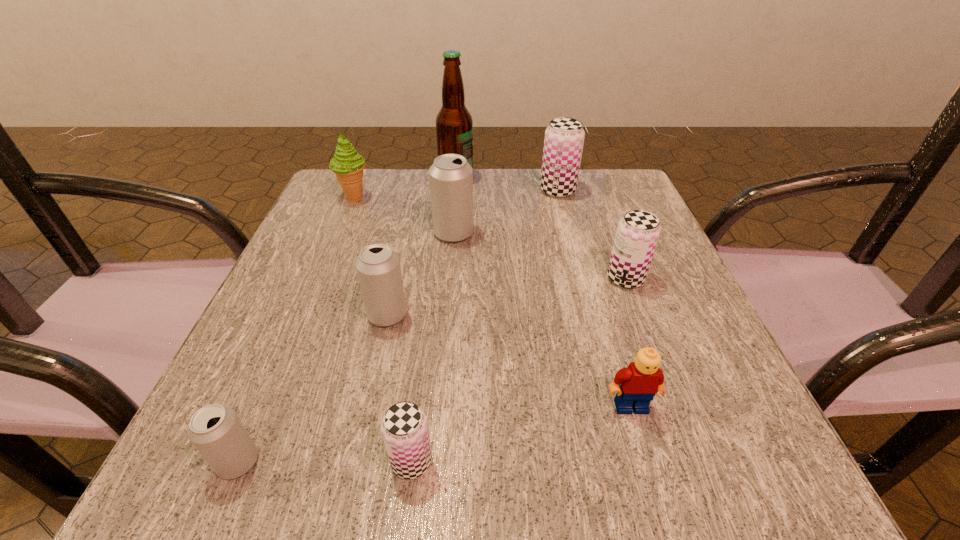
At what (x,y) coordinates should I click in order to perform the action: click on empty space between the sixth farthest object and the rightmost white beer can. Please return your answer as a coordinate pair (x, y). The height and width of the screenshot is (540, 960). Looking at the image, I should click on click(x=420, y=274).

The height and width of the screenshot is (540, 960). What are the coordinates of `object that stands as the sixth closest to the tallest object` in the screenshot? It's located at (636, 385).

Locate which object ranks fourth in proximity to the second biggest white beer can. Please provide its 2D coordinates. Your answer should be formatted as a tuple, i.e. [(x, y)], where the tuple contains the x and y coordinates of a point satisfying the conditions above.

[(347, 164)]

Locate an element on the screen. This screenshot has height=540, width=960. the fifth closest beer can to the nearest white beer can is located at coordinates (563, 144).

Identify which beer can is the nearest to the leftmost beer can. Please provide its 2D coordinates. Your answer should be formatted as a tuple, i.e. [(x, y)], where the tuple contains the x and y coordinates of a point satisfying the conditions above.

[(404, 427)]

Choose which purple beer can is the nearest neighbor to the fourth farthest object. Please provide its 2D coordinates. Your answer should be formatted as a tuple, i.e. [(x, y)], where the tuple contains the x and y coordinates of a point satisfying the conditions above.

[(563, 144)]

Select which purple beer can appears as the third closest to the green icecream. Please provide its 2D coordinates. Your answer should be formatted as a tuple, i.e. [(x, y)], where the tuple contains the x and y coordinates of a point satisfying the conditions above.

[(404, 427)]

Select which white beer can appears as the second closest to the nearest white beer can. Please provide its 2D coordinates. Your answer should be formatted as a tuple, i.e. [(x, y)], where the tuple contains the x and y coordinates of a point satisfying the conditions above.

[(451, 177)]

Select which white beer can is the closest to the farthest beer can. Please provide its 2D coordinates. Your answer should be formatted as a tuple, i.e. [(x, y)], where the tuple contains the x and y coordinates of a point satisfying the conditions above.

[(451, 177)]

In order to click on vacant space that satisfies the following two spatial constraints: 1. on the label of the second purple beer can from left to right; 2. on the left side of the brown beer bottle in this screenshot , I will do pyautogui.click(x=455, y=191).